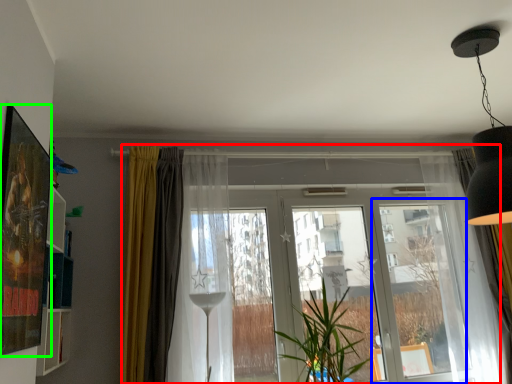
Question: Which object is the farthest from window (highlighted by a red box)? Choose among these: screen door (highlighted by a blue box) or picture frame (highlighted by a green box).

Choices:
 (A) screen door
 (B) picture frame

Answer: (B)